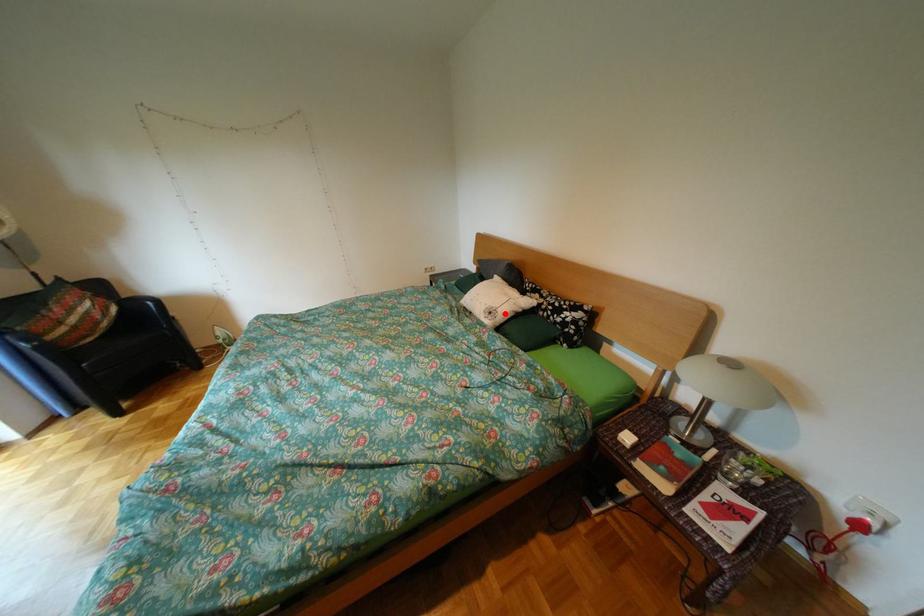
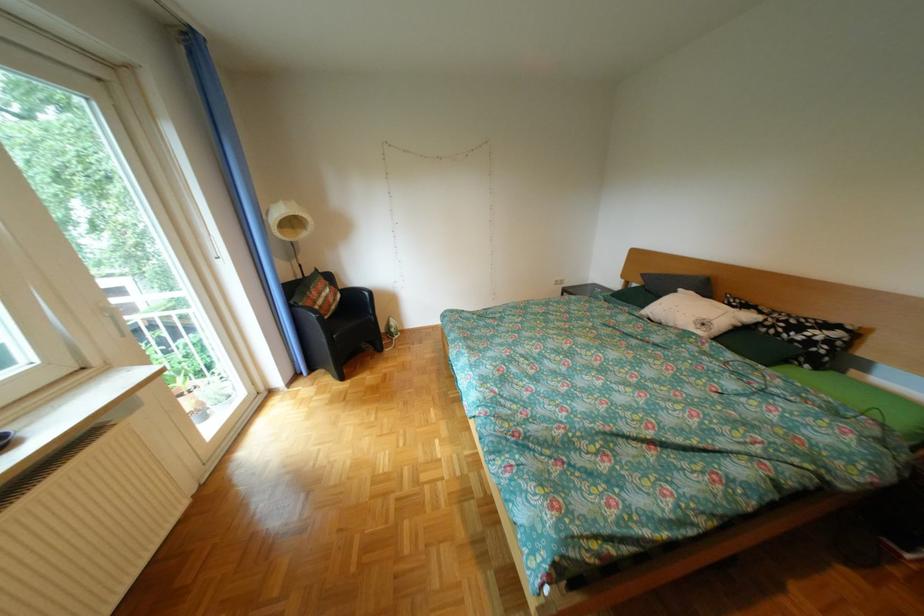
Locate, in the second image, the point that corresponds to the highlighted location in the first image.

(718, 325)